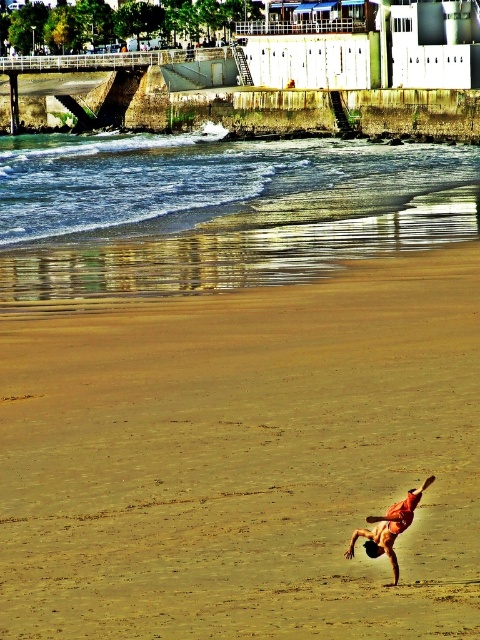
You are standing at the beach and want to walk towards the shoreline. There are two points marked on the sand. One is at point (372, 419) and the other at point (371, 556). Which point should you step on first to reach the shoreline more quickly?

Point (371, 556) should be stepped on first because it is closer to the shoreline than point (372, 419), which is behind it.